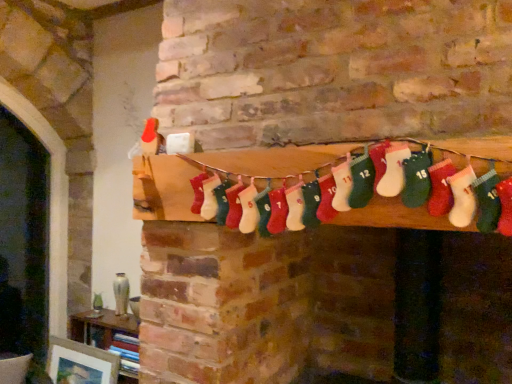
Identify the location of blank space situated above matte white picture frame at lower left (from a real-world perspective). This screenshot has height=384, width=512. (78, 347).